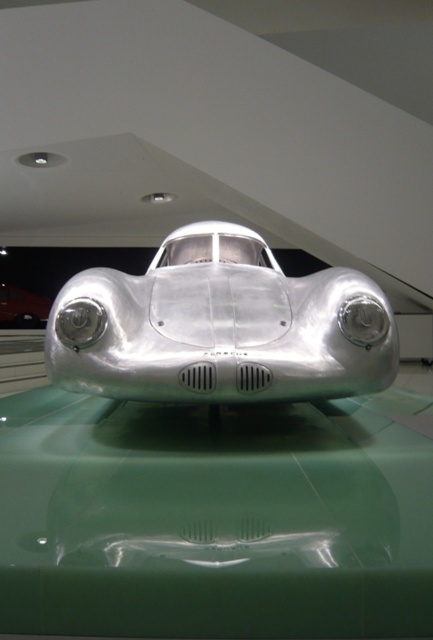
Is point (296, 291) less distant than point (3, 312)?

That is True.

Looking at this image, does silver metallic car at center have a greater width compared to polished silver car at center?

Correct, the width of silver metallic car at center exceeds that of polished silver car at center.

Image resolution: width=433 pixels, height=640 pixels. I want to click on silver metallic car at center, so click(x=219, y=326).